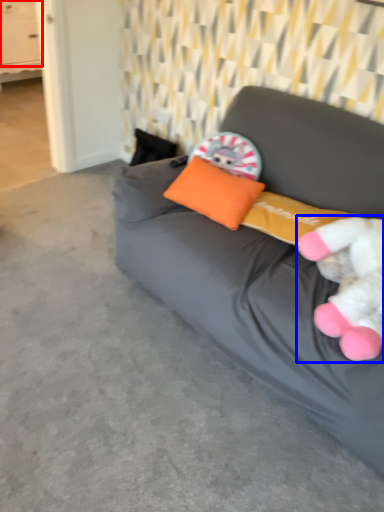
Question: Among these objects, which one is farthest to the camera, drawer (highlighted by a red box) or toy (highlighted by a blue box)?

Choices:
 (A) drawer
 (B) toy

Answer: (A)